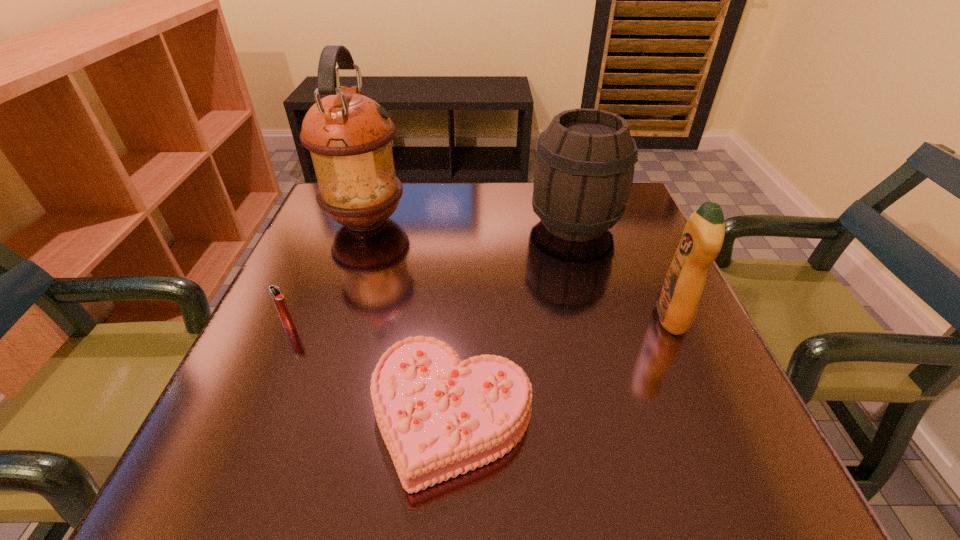
Find the location of `object located at the far left corner`. object located at the far left corner is located at coordinates (349, 135).

Find the location of a particular element. This screenshot has height=540, width=960. object present at the far right corner is located at coordinates (584, 169).

Where is `free space at the far edge`? The width and height of the screenshot is (960, 540). free space at the far edge is located at coordinates (530, 218).

At what (x,y) coordinates should I click in order to perform the action: click on free location at the near edge. Please return your answer as a coordinate pair (x, y). The height and width of the screenshot is (540, 960). Looking at the image, I should click on (499, 486).

This screenshot has width=960, height=540. I want to click on free space at the left edge of the desktop, so click(300, 256).

Locate an element on the screen. The image size is (960, 540). free spot at the right edge of the desktop is located at coordinates (645, 272).

Find the location of `free space at the near left corner of the desktop`. free space at the near left corner of the desktop is located at coordinates (229, 461).

Where is `vacant space at the near right corner`? Image resolution: width=960 pixels, height=540 pixels. vacant space at the near right corner is located at coordinates (721, 479).

Identify the location of free space between the shortest object and the oil lamp. 409,319.

You are a GUI agent. You are given a task and a screenshot of the screen. Output one action in this format:
    pyautogui.click(x=<x>, y=<y>)
    Task: Click on the free area in between the second shortest object and the cake
    This screenshot has width=960, height=540.
    Given the screenshot: What is the action you would take?
    pyautogui.click(x=370, y=370)